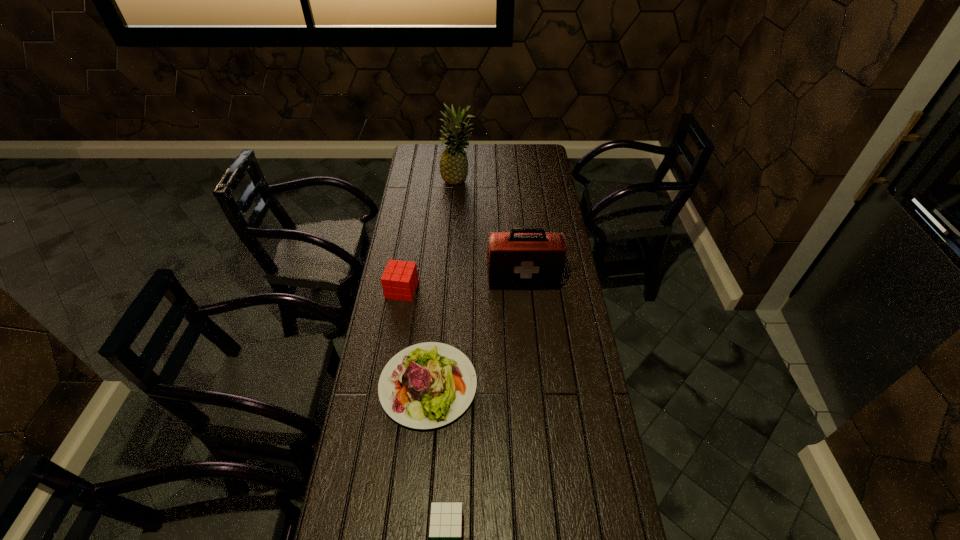
You are a GUI agent. You are given a task and a screenshot of the screen. Output one action in this format:
    pyautogui.click(x=<x>, y=<y>)
    Task: Click on the free space located 0.060m on the right of the salad plate
    The height and width of the screenshot is (540, 960).
    Given the screenshot: What is the action you would take?
    pyautogui.click(x=494, y=386)

Locate an element on the screen. This screenshot has height=540, width=960. cube that is positioned at the left edge is located at coordinates (399, 281).

At what (x,y) coordinates should I click in order to perform the action: click on salad plate at the left edge. Please return your answer as a coordinate pair (x, y). The image size is (960, 540). Looking at the image, I should click on (427, 385).

This screenshot has width=960, height=540. Identify the location of object at the right edge. pos(526,258).

The width and height of the screenshot is (960, 540). I want to click on vacant area at the far edge, so click(x=516, y=156).

Locate an element on the screen. Image resolution: width=960 pixels, height=540 pixels. vacant point at the left edge is located at coordinates (385, 319).

Find the location of a particular element. The image size is (960, 540). vacant space at the right edge of the desktop is located at coordinates (587, 506).

Image resolution: width=960 pixels, height=540 pixels. I want to click on free location at the far left corner of the desktop, so click(x=438, y=151).

This screenshot has width=960, height=540. Find the location of `vacant space at the far right corner of the desktop`. vacant space at the far right corner of the desktop is located at coordinates (525, 145).

Locate an element on the screen. The image size is (960, 540). free space between the tallest object and the second nearest object is located at coordinates (444, 284).